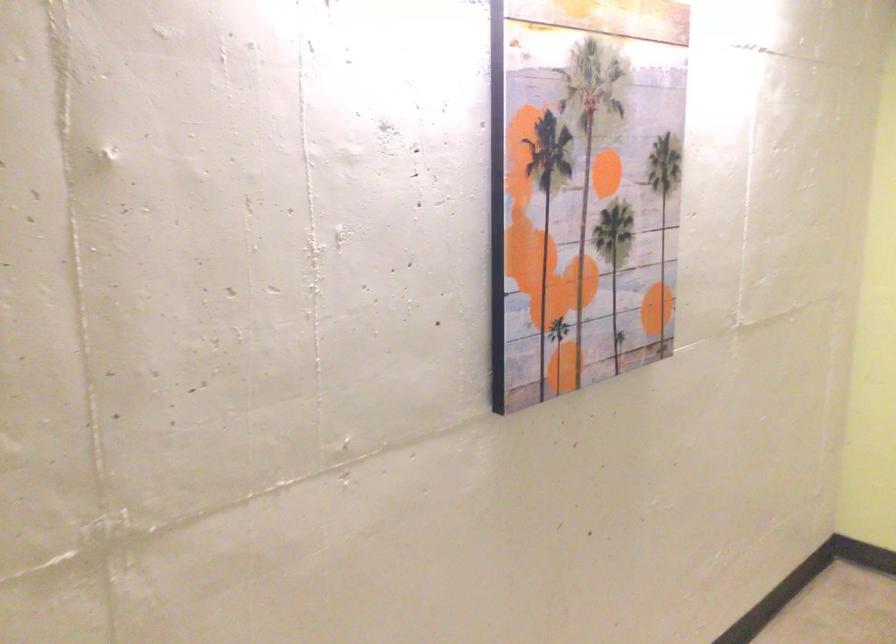
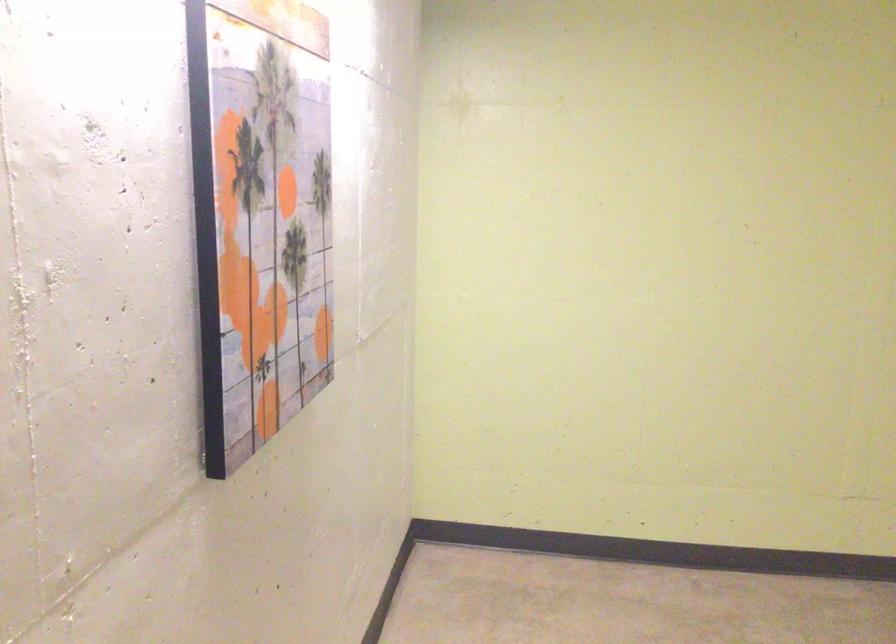
Locate, in the second image, the point that corresponds to point (564, 199) in the first image.

(260, 216)